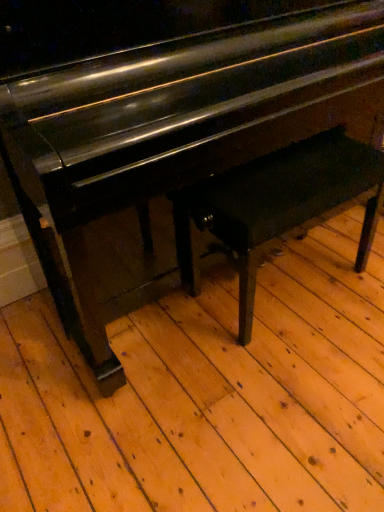
The width and height of the screenshot is (384, 512). What do you see at coordinates (278, 205) in the screenshot? I see `black polished wood music stool at center` at bounding box center [278, 205].

Where is `black polished wood music stool at center`? Image resolution: width=384 pixels, height=512 pixels. black polished wood music stool at center is located at coordinates (278, 205).

Locate an element on the screen. The height and width of the screenshot is (512, 384). black polished wood music stool at center is located at coordinates (278, 205).